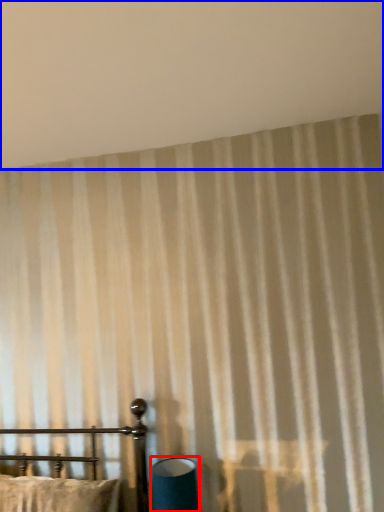
Question: Which object appears farthest to the camera in this image, table lamp (highlighted by a red box) or backdrop (highlighted by a blue box)?

Choices:
 (A) table lamp
 (B) backdrop

Answer: (A)